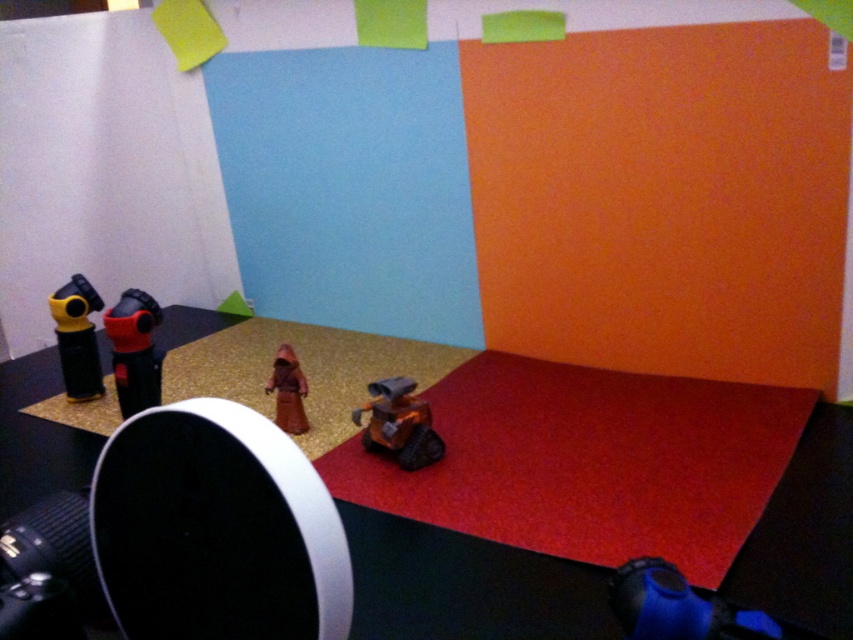
Between gold textured carpet at center and matte brown robe at center, which one has more height?

gold textured carpet at center

Between gold textured carpet at center and matte brown robe at center, which one appears on the right side from the viewer's perspective?

Positioned to the right is gold textured carpet at center.

Looking at this image, who is more distant from viewer, (843,136) or (294,433)?

Positioned behind is point (294,433).

This screenshot has width=853, height=640. What are the coordinates of `gold textured carpet at center` in the screenshot? It's located at (451, 177).

Does matte black camera at left have a lesser width compared to yellow plastic camera at left?

Incorrect, matte black camera at left's width is not less than yellow plastic camera at left's.

Does matte black camera at left have a larger size compared to yellow plastic camera at left?

Indeed, matte black camera at left has a larger size compared to yellow plastic camera at left.

Which is in front, point (135, 330) or point (84, 342)?

Point (135, 330)

You are a GUI agent. You are given a task and a screenshot of the screen. Output one action in this format:
    pyautogui.click(x=<x>, y=<y>)
    Task: Click on the matte black camera at left
    
    Given the screenshot: What is the action you would take?
    pyautogui.click(x=134, y=349)

Is gold textured carpet at center positioned before matte black camera at left?

Yes, it is in front of matte black camera at left.

Is gold textured carpet at center to the left of matte black camera at left from the viewer's perspective?

No, gold textured carpet at center is not to the left of matte black camera at left.

Who is more forward, [61,74] or [120,408]?

Point [120,408] is more forward.

Image resolution: width=853 pixels, height=640 pixels. In order to click on gold textured carpet at center in this screenshot , I will do `click(451, 177)`.